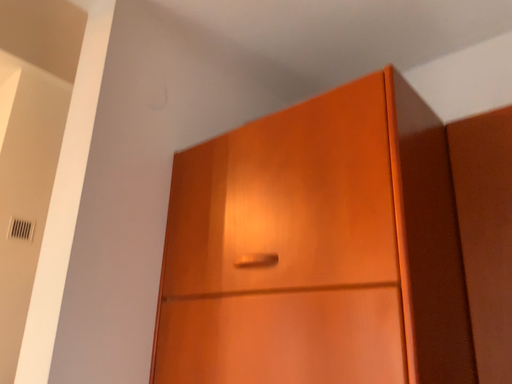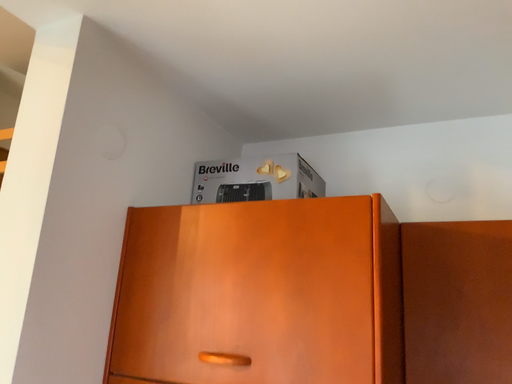
Question: How did the camera likely rotate when shooting the video?

Choices:
 (A) rotated right
 (B) rotated left

Answer: (A)